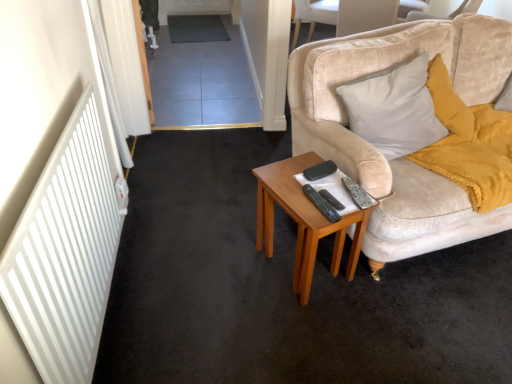
The height and width of the screenshot is (384, 512). In order to click on vacant space that is to the left of black plastic remote control at center, which ranks as the 2th remote control in left-to-right order in this screenshot , I will do `click(292, 195)`.